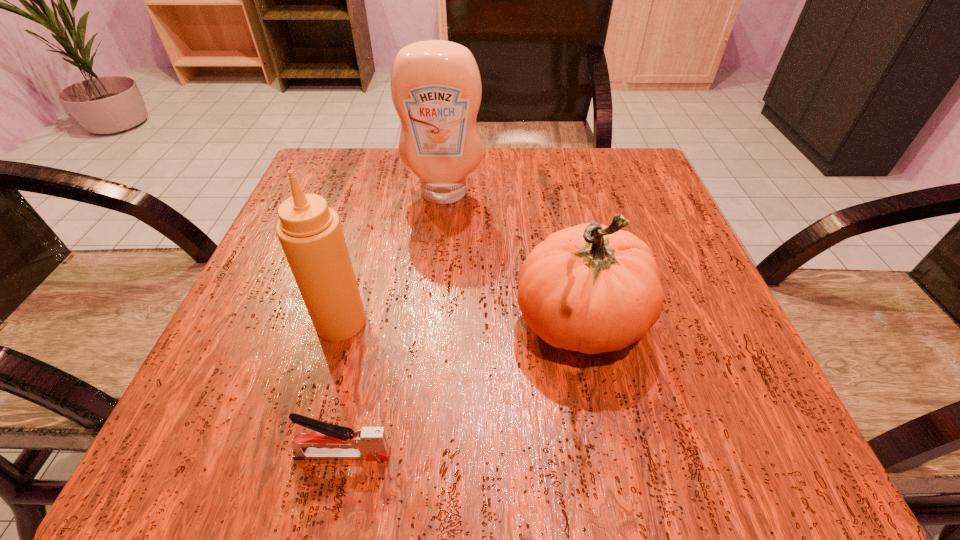
Identify the location of object at the far edge. This screenshot has height=540, width=960. (436, 89).

Where is `object situated at the near edge`? Image resolution: width=960 pixels, height=540 pixels. object situated at the near edge is located at coordinates (328, 441).

Identify the location of condiment located at the left edge. (310, 233).

Identify the location of stapler that is at the left edge. This screenshot has width=960, height=540. (328, 441).

In order to click on object at the right edge in this screenshot , I will do `click(592, 288)`.

Image resolution: width=960 pixels, height=540 pixels. Find the location of `object that is at the near left corner`. object that is at the near left corner is located at coordinates (328, 441).

Locate an element on the screen. The height and width of the screenshot is (540, 960). vacant point at the far edge is located at coordinates (396, 187).

Identify the location of vacant space at the left edge of the desktop. (265, 254).

In the image, there is a desktop. In order to click on blank space at the right edge in this screenshot , I will do `click(703, 303)`.

I want to click on free space at the far left corner, so click(341, 200).